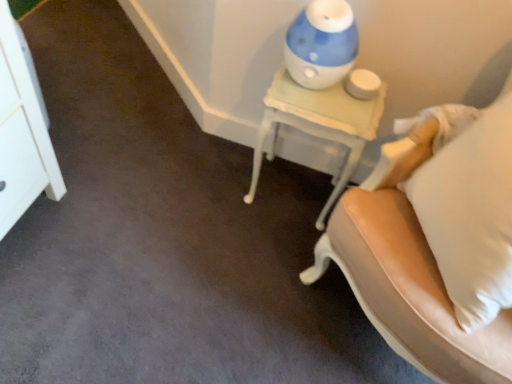
What do you see at coordinates (21, 134) in the screenshot? I see `white glossy dresser at upper left` at bounding box center [21, 134].

Measure the distance between blue plastic humidifier at upper right and camera.

3.50 feet.

You are a GUI agent. You are given a task and a screenshot of the screen. Output one action in this format:
    pyautogui.click(x=<x>, y=<y>)
    Task: Click on the white glossy dresser at upper left
    The height and width of the screenshot is (384, 512).
    Given the screenshot: What is the action you would take?
    pyautogui.click(x=21, y=134)

Could you tell me if white painted wood nightstand at upper right is turned towards white leather chair at right?

No, white painted wood nightstand at upper right is not oriented towards white leather chair at right.

From the image's perspective, is white painted wood nightstand at upper right above or below white leather chair at right?

white painted wood nightstand at upper right is above white leather chair at right.

Does white painted wood nightstand at upper right appear on the left side of white leather chair at right?

Yes.

Considering the points (329, 98) and (443, 354), which point is in front, point (329, 98) or point (443, 354)?

The point (443, 354) is closer.

Does blue plastic humidifier at upper right appear on the right side of white leather chair at right?

No, blue plastic humidifier at upper right is not to the right of white leather chair at right.

Choose the correct answer: Is blue plastic humidifier at upper right inside white leather chair at right or outside it?

blue plastic humidifier at upper right cannot be found inside white leather chair at right.

Which of these two, blue plastic humidifier at upper right or white leather chair at right, is wider?

Wider between the two is white leather chair at right.

Based on the photo, from a real-world perspective, does blue plastic humidifier at upper right sit lower than white leather chair at right?

No, from a real-world perspective, blue plastic humidifier at upper right is not under white leather chair at right.

Is white leather chair at right to the left or to the right of white painted wood nightstand at upper right in the image?

In the image, white leather chair at right appears on the right side of white painted wood nightstand at upper right.

Who is smaller, white leather chair at right or white painted wood nightstand at upper right?

Smaller between the two is white painted wood nightstand at upper right.

Is white leather chair at right facing away from white painted wood nightstand at upper right?

No, white leather chair at right's orientation is not away from white painted wood nightstand at upper right.

Is white leather chair at right beside white painted wood nightstand at upper right?

No, white leather chair at right is not with white painted wood nightstand at upper right.

Which object is closer to the camera taking this photo, white glossy dresser at upper left or white leather chair at right?

white leather chair at right is closer to the camera.

Who is smaller, white glossy dresser at upper left or white leather chair at right?

white glossy dresser at upper left.

Is white glossy dresser at upper left taller than white leather chair at right?

No, white glossy dresser at upper left is not taller than white leather chair at right.

Does white glossy dresser at upper left have a greater width compared to white leather chair at right?

Incorrect, the width of white glossy dresser at upper left does not surpass that of white leather chair at right.

Consider the image. Is the depth of white glossy dresser at upper left less than that of blue plastic humidifier at upper right?

Result: No, white glossy dresser at upper left is behind blue plastic humidifier at upper right.

Based on the photo, from the image's perspective, is white glossy dresser at upper left positioned above or below blue plastic humidifier at upper right?

Clearly, from the image's perspective, white glossy dresser at upper left is above blue plastic humidifier at upper right.

How different are the orientations of white glossy dresser at upper left and blue plastic humidifier at upper right in degrees?

They differ by 91.9 degrees in their facing directions.

Can we say white glossy dresser at upper left lies outside blue plastic humidifier at upper right?

That's correct, white glossy dresser at upper left is outside of blue plastic humidifier at upper right.

Which point is more distant from viewer, (396, 120) or (2, 169)?

Positioned behind is point (396, 120).

Image resolution: width=512 pixels, height=384 pixels. What are the coordinates of `furniture that is below the white glossy dresser at upper left (from the image's perspective)` in the screenshot? It's located at (409, 263).

Would you say white leather chair at right contains white glossy dresser at upper left?

Definitely not — white glossy dresser at upper left is not inside white leather chair at right.

Does white leather chair at right have a lesser height compared to white glossy dresser at upper left?

No.

Consider the image. Is white leather chair at right in front of or behind blue plastic humidifier at upper right in the image?

Clearly, white leather chair at right is in front of blue plastic humidifier at upper right.

In terms of size, does white leather chair at right appear bigger or smaller than blue plastic humidifier at upper right?

In the image, white leather chair at right appears to be larger than blue plastic humidifier at upper right.

Is point (507, 357) farther from viewer compared to point (304, 16)?

That is False.

The height and width of the screenshot is (384, 512). In order to click on nightstand below the white leather chair at right (from a real-world perspective) in this screenshot , I will do `click(319, 123)`.

The height and width of the screenshot is (384, 512). In order to click on table lamp that appears behind the white leather chair at right in this screenshot , I will do `click(321, 44)`.

When comparing their distances from blue plastic humidifier at upper right, does white glossy dresser at upper left or white painted wood nightstand at upper right seem closer?

white painted wood nightstand at upper right is closer to blue plastic humidifier at upper right.

Based on their spatial positions, is white glossy dresser at upper left or white leather chair at right further from white painted wood nightstand at upper right?

The object further to white painted wood nightstand at upper right is white glossy dresser at upper left.

Considering their positions, is white painted wood nightstand at upper right positioned closer to white glossy dresser at upper left than blue plastic humidifier at upper right?

white painted wood nightstand at upper right.

When comparing their distances from blue plastic humidifier at upper right, does white leather chair at right or white painted wood nightstand at upper right seem further?

Based on the image, white leather chair at right appears to be further to blue plastic humidifier at upper right.

Based on their spatial positions, is white painted wood nightstand at upper right or white leather chair at right further from blue plastic humidifier at upper right?

→ white leather chair at right is further to blue plastic humidifier at upper right.

In the scene shown: From the image, which object appears to be farther from white leather chair at right, white glossy dresser at upper left or blue plastic humidifier at upper right?

white glossy dresser at upper left lies further to white leather chair at right than the other object.

Estimate the real-world distances between objects in this image. Which object is closer to white painted wood nightstand at upper right, white glossy dresser at upper left or blue plastic humidifier at upper right?

blue plastic humidifier at upper right.

Looking at the image, which one is located further to white glossy dresser at upper left, white leather chair at right or blue plastic humidifier at upper right?

white leather chair at right lies further to white glossy dresser at upper left than the other object.

The height and width of the screenshot is (384, 512). What are the coordinates of `nightstand situated between white glossy dresser at upper left and white leather chair at right from left to right` in the screenshot? It's located at (319, 123).

You are a GUI agent. You are given a task and a screenshot of the screen. Output one action in this format:
    pyautogui.click(x=<x>, y=<y>)
    Task: Click on the table lamp between white glossy dresser at upper left and white leather chair at right in the horizontal direction
    This screenshot has width=512, height=384.
    Given the screenshot: What is the action you would take?
    pyautogui.click(x=321, y=44)

At what (x,y) coordinates should I click in order to perform the action: click on nightstand between white glossy dresser at upper left and blue plastic humidifier at upper right from left to right. Please return your answer as a coordinate pair (x, y). Image resolution: width=512 pixels, height=384 pixels. Looking at the image, I should click on (319, 123).

In order to click on table lamp between white leather chair at right and white painted wood nightstand at upper right along the z-axis in this screenshot , I will do `click(321, 44)`.